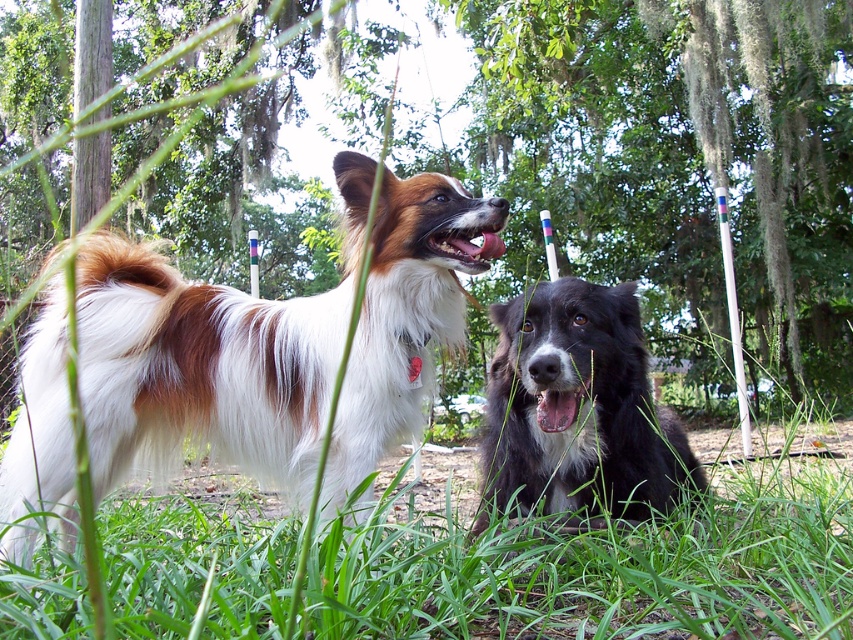
Does white and brown fur dog at left appear over black fluffy dog at center?

Indeed, white and brown fur dog at left is positioned over black fluffy dog at center.

Does white and brown fur dog at left appear on the right side of black fluffy dog at center?

In fact, white and brown fur dog at left is to the left of black fluffy dog at center.

Is point (131, 273) less distant than point (531, 451)?

Yes, point (131, 273) is in front of point (531, 451).

I want to click on white and brown fur dog at left, so click(209, 360).

Is green leafy tree at upper center bigger than green grass at lower center?

Yes, green leafy tree at upper center is bigger than green grass at lower center.

Between green leafy tree at upper center and green grass at lower center, which one appears on the right side from the viewer's perspective?

green grass at lower center is more to the right.

Identify the location of green leafy tree at upper center. The height and width of the screenshot is (640, 853). [674, 163].

How far apart are green grass at lower center and black fluffy dog at center?

The distance of green grass at lower center from black fluffy dog at center is 18.81 inches.

Between point (201, 545) and point (529, 476), which one is positioned behind?

Point (201, 545)

Does point (639, 568) come farther from viewer compared to point (647, 464)?

No, it is in front of (647, 464).

Where is `green grass at lower center`? The width and height of the screenshot is (853, 640). green grass at lower center is located at coordinates (599, 566).